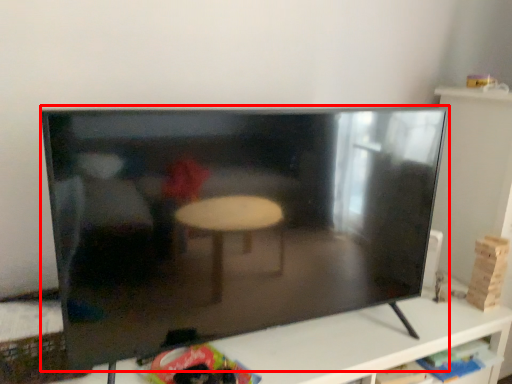
Question: From the image's perspective, where is television (annotated by the red box) located relative to furniture?

Choices:
 (A) above
 (B) below

Answer: (A)